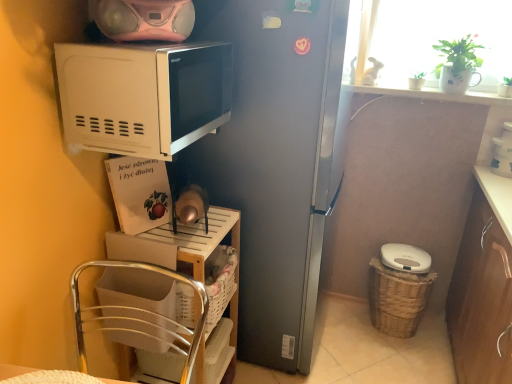
Question: In the image, is pink matte speaker at upper center, marked as the third appliance in a bottom-to-top arrangement, on the left side or the right side of white glossy coffee maker at upper right, which is counted as the 3th appliance, starting from the left?

Choices:
 (A) left
 (B) right

Answer: (A)

Question: Is point (136, 3) positioned closer to the camera than point (496, 173)?

Choices:
 (A) closer
 (B) farther

Answer: (A)

Question: Based on their relative distances, which object is nearer to the white woven basket at lower center, which appears as the 2th basket when viewed from the back?

Choices:
 (A) white plastic shelf at lower left
 (B) green matte plant at upper right
 (C) brown wood cabinet at lower right
 (D) woven brown basket at lower right, the third basket in the left-to-right sequence
 (E) white matte microwave at upper left

Answer: (A)

Question: Considering the real-world distances, which object is closest to the white woven table at lower left?

Choices:
 (A) white woven basket at lower left, which is counted as the third basket, starting from the right
 (B) pink matte speaker at upper center, which is counted as the first appliance, starting from the top
 (C) green matte plant at upper right
 (D) white woven basket at lower center, which is the 2th basket from left to right
 (E) white matte microwave at upper left

Answer: (A)